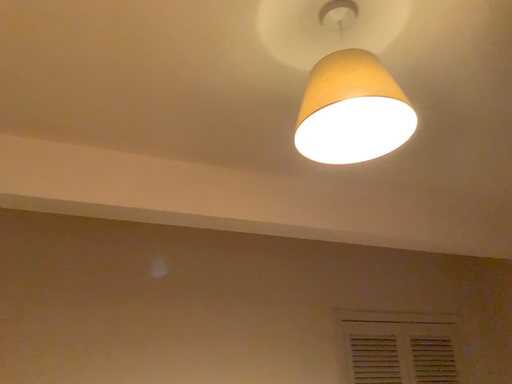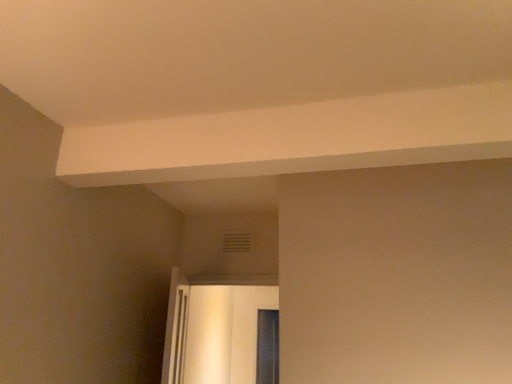
Question: How did the camera likely rotate when shooting the video?

Choices:
 (A) rotated left
 (B) rotated right

Answer: (A)